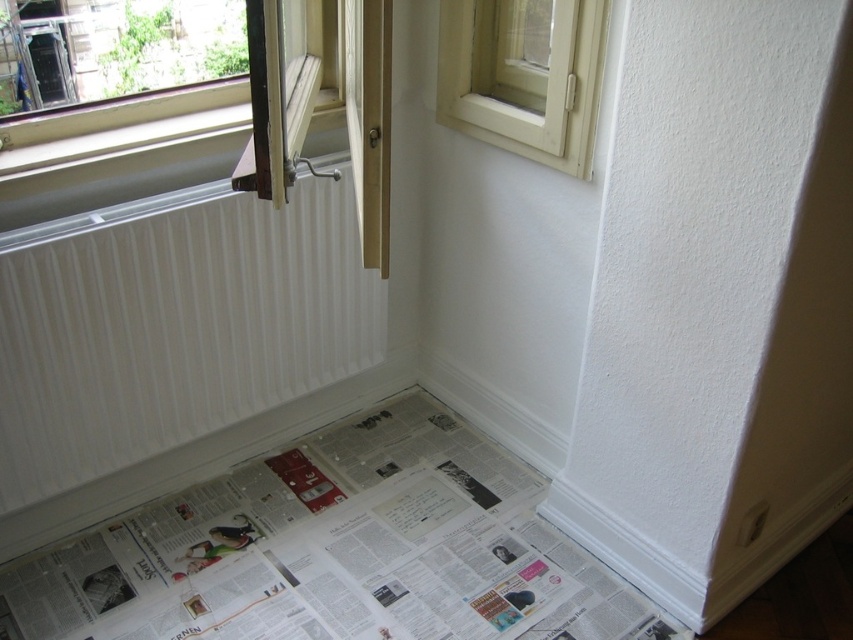
Question: Is white printed newspaper at lower left thinner than white ribbed radiator at lower left?

Choices:
 (A) yes
 (B) no

Answer: (B)

Question: Can you confirm if white printed newspaper at lower left is thinner than white ribbed radiator at lower left?

Choices:
 (A) no
 (B) yes

Answer: (A)

Question: Can you confirm if white printed newspaper at lower left is positioned below white ribbed radiator at lower left?

Choices:
 (A) yes
 (B) no

Answer: (A)

Question: Which object is positioned farthest from the white plastic window at upper right?

Choices:
 (A) white ribbed radiator at lower left
 (B) white printed newspaper at lower left

Answer: (B)

Question: Which object appears farthest from the camera in this image?

Choices:
 (A) white printed newspaper at lower left
 (B) white ribbed radiator at lower left
 (C) white plastic window at upper right

Answer: (A)

Question: Which point appears farthest from the camera in this image?

Choices:
 (A) (169, 336)
 (B) (572, 51)
 (C) (515, 532)

Answer: (C)